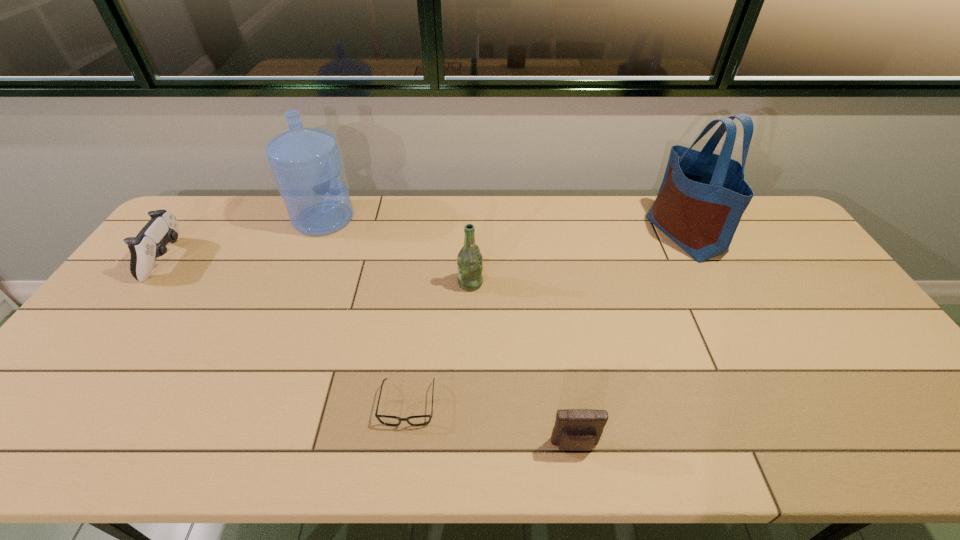
Identify the location of object present at the far left corner. (150, 243).

In the image, there is a desktop. Identify the location of blank space at the far edge. (461, 209).

In order to click on free space at the near edge of the desktop in this screenshot , I will do `click(517, 436)`.

Locate an element on the screen. free space at the left edge is located at coordinates (125, 317).

This screenshot has width=960, height=540. In the image, there is a desktop. In order to click on vacant space at the right edge in this screenshot , I will do `click(919, 407)`.

Locate an element on the screen. The image size is (960, 540). vacant space at the far right corner of the desktop is located at coordinates (789, 234).

Where is `free region at the near right corner of the desktop`? The width and height of the screenshot is (960, 540). free region at the near right corner of the desktop is located at coordinates (897, 439).

You are a GUI agent. You are given a task and a screenshot of the screen. Output one action in this format:
    pyautogui.click(x=<x>, y=<y>)
    Task: Click on the unoccupied position between the shortest object and the second object from right to left
    The height and width of the screenshot is (540, 960).
    Given the screenshot: What is the action you would take?
    pyautogui.click(x=492, y=425)

This screenshot has width=960, height=540. Identify the location of vacant space in between the handbag and the leftmost object. (426, 247).

This screenshot has width=960, height=540. What are the coordinates of `free point between the pouch and the shortest object` in the screenshot? It's located at (492, 425).